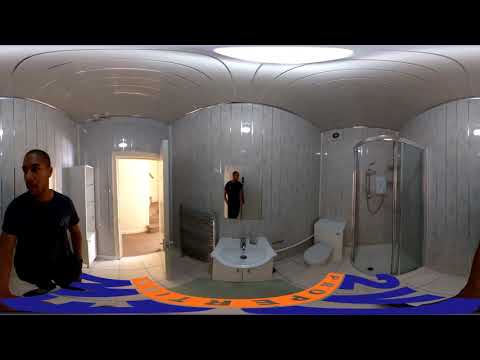
Locate an element on the screen. shower stall is located at coordinates (369, 215).